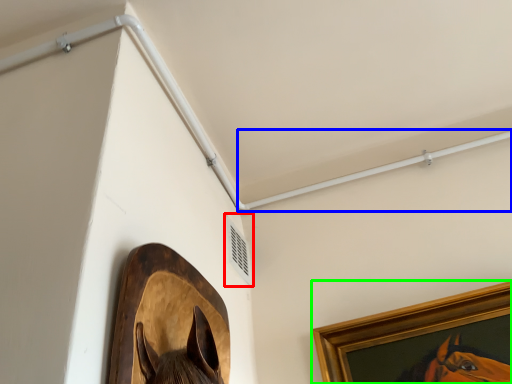
Question: Which object is the closest to the air conditioning (highlighted by a red box)? Choose among these: beam (highlighted by a blue box) or picture frame (highlighted by a green box).

Choices:
 (A) beam
 (B) picture frame

Answer: (A)